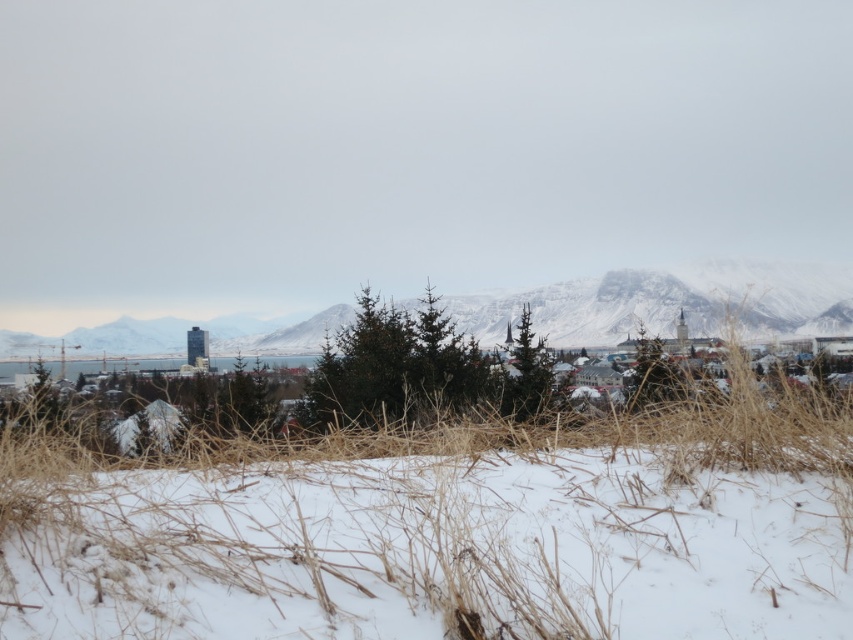
Question: Which point is farther to the camera?

Choices:
 (A) (670, 324)
 (B) (759, 440)

Answer: (A)

Question: Does white dry grass at center have a larger size compared to snowy rock formation at center?

Choices:
 (A) no
 (B) yes

Answer: (A)

Question: Does white dry grass at center appear on the right side of snowy rock formation at center?

Choices:
 (A) yes
 (B) no

Answer: (B)

Question: Does white dry grass at center appear on the left side of snowy rock formation at center?

Choices:
 (A) no
 (B) yes

Answer: (B)